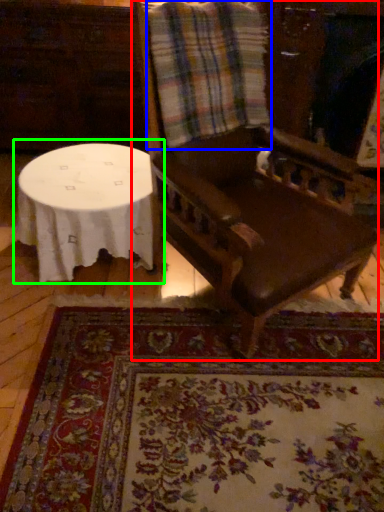
Question: Which object is the closest to the chair (highlighted by a red box)? Choose among these: flannel (highlighted by a blue box) or table (highlighted by a green box).

Choices:
 (A) flannel
 (B) table

Answer: (A)